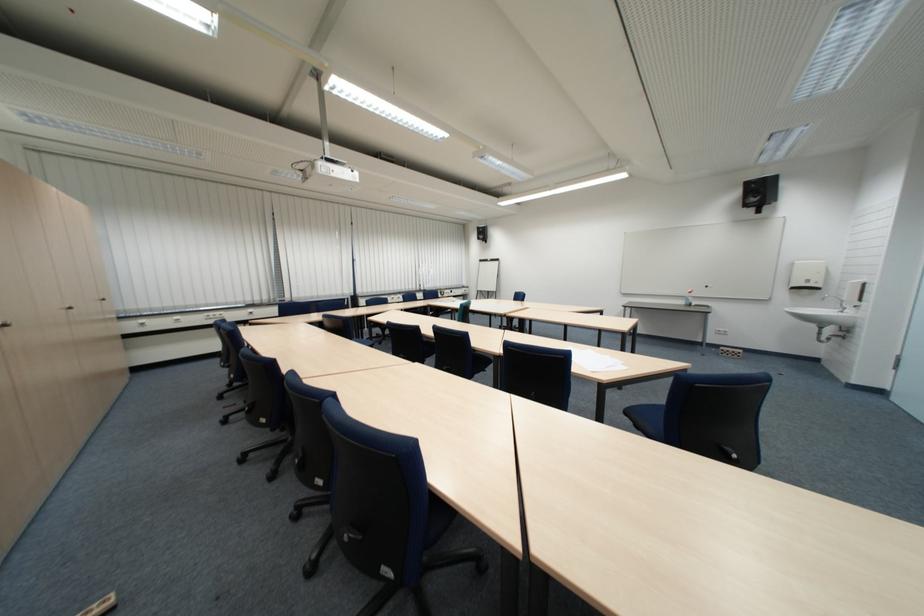
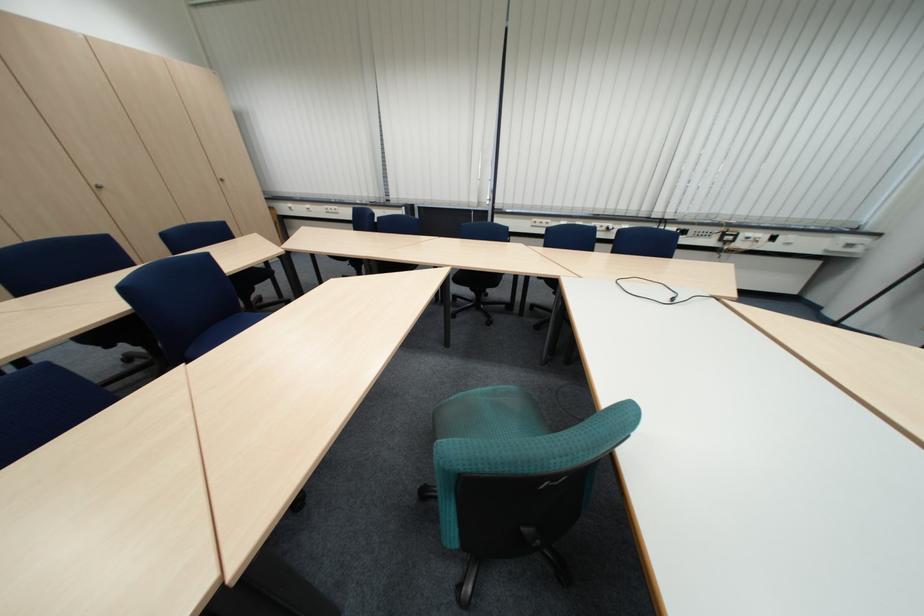
Question: I am providing you with two images of the same scene from different viewpoints. Which of the following objects are not visible in image2?

Choices:
 (A) silver cabinet knob
 (B) telephone handset
 (C) blind adjustment wand
 (D) none of these

Answer: (D)